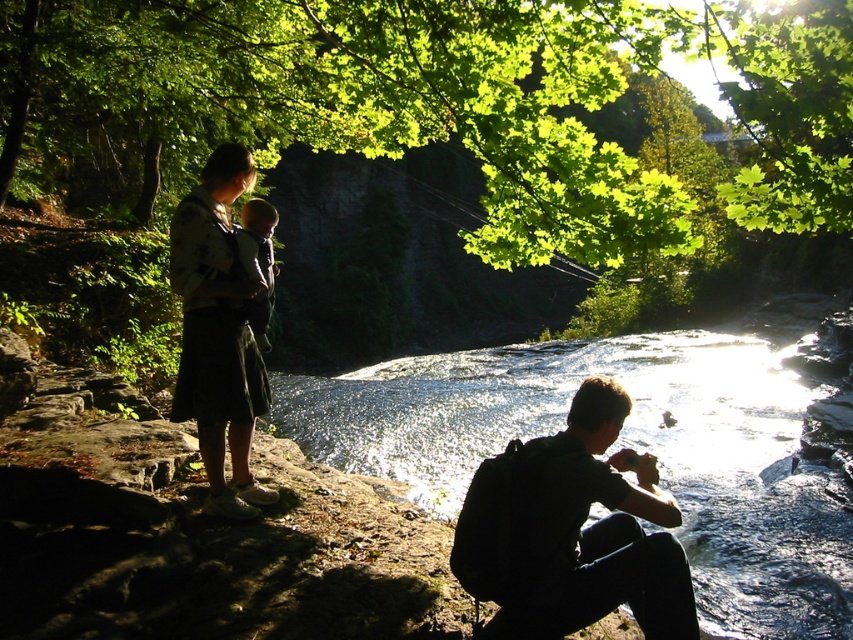
Question: Which of these objects is positioned farthest from the translucent water at center?

Choices:
 (A) dark gray skirt at left
 (B) green leafy tree at upper center

Answer: (A)

Question: Does green leafy tree at upper center have a smaller size compared to soft gray fabric baby at center?

Choices:
 (A) yes
 (B) no

Answer: (B)

Question: Is green leafy tree at upper center thinner than translucent water at center?

Choices:
 (A) yes
 (B) no

Answer: (B)

Question: Does translucent water at center appear over dark gray skirt at left?

Choices:
 (A) no
 (B) yes

Answer: (A)

Question: Which of the following is the farthest from the observer?

Choices:
 (A) green leafy tree at upper center
 (B) soft gray fabric baby at center
 (C) dark gray skirt at left
 (D) translucent water at center

Answer: (B)

Question: Which object appears closest to the camera in this image?

Choices:
 (A) translucent water at center
 (B) black matte shirt at lower right
 (C) dark gray skirt at left

Answer: (B)